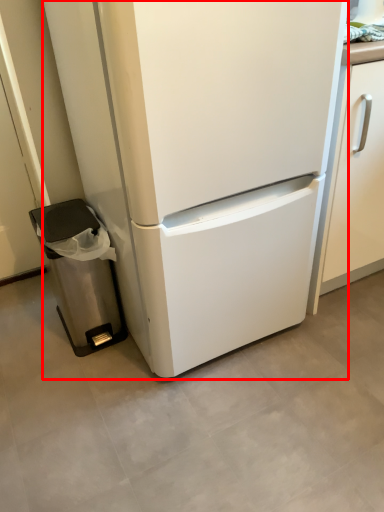
Question: From the image's perspective, what is the correct spatial positioning of refrigerator (annotated by the red box) in reference to trash bin/can?

Choices:
 (A) above
 (B) below

Answer: (A)